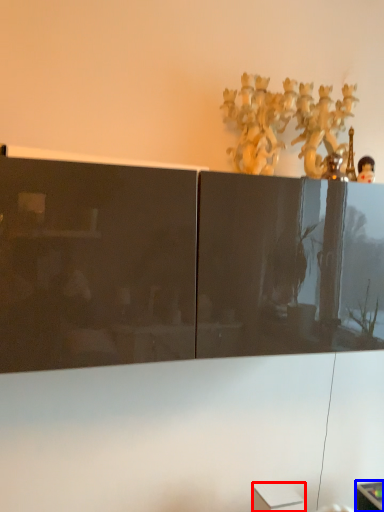
Question: Which object appears closest to the camera in this image, cabinetry (highlighted by a red box) or furniture (highlighted by a blue box)?

Choices:
 (A) cabinetry
 (B) furniture

Answer: (A)